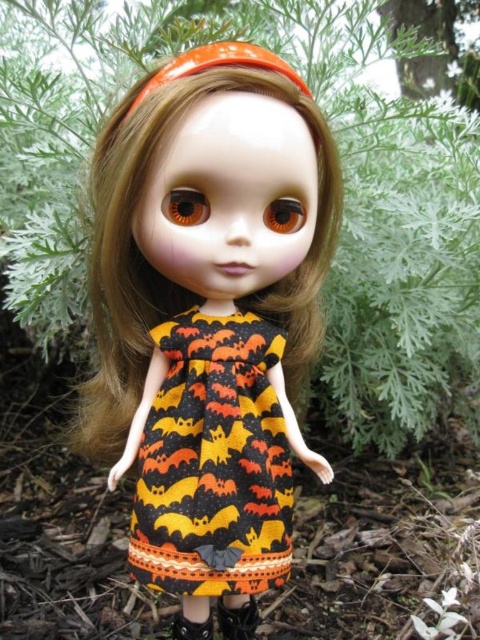
Which is above, orange bat print fabric dress at center or black leather shoe at lower center?

orange bat print fabric dress at center is above.

Describe the element at coordinates (214, 461) in the screenshot. This screenshot has width=480, height=640. I see `orange bat print fabric dress at center` at that location.

The height and width of the screenshot is (640, 480). Find the location of `orange bat print fabric dress at center`. orange bat print fabric dress at center is located at coordinates (214, 461).

Locate an element on the screen. This screenshot has height=640, width=480. orange bat print fabric dress at center is located at coordinates (214, 461).

Between orange fabric dress at center and black matte shoe at lower center, which one appears on the left side from the viewer's perspective?

From the viewer's perspective, orange fabric dress at center appears more on the left side.

Can you confirm if orange fabric dress at center is smaller than black matte shoe at lower center?

No, orange fabric dress at center is not smaller than black matte shoe at lower center.

You are a GUI agent. You are given a task and a screenshot of the screen. Output one action in this format:
    pyautogui.click(x=<x>, y=<y>)
    Task: Click on the orange fabric dress at center
    This screenshot has width=480, height=640.
    Given the screenshot: What is the action you would take?
    pyautogui.click(x=208, y=308)

Does green leafy plant at center appear on the left side of black matte shoe at lower center?

Incorrect, green leafy plant at center is not on the left side of black matte shoe at lower center.

Who is higher up, green leafy plant at center or black matte shoe at lower center?

green leafy plant at center is above.

Find the location of a particular element. The image size is (480, 640). green leafy plant at center is located at coordinates (344, 182).